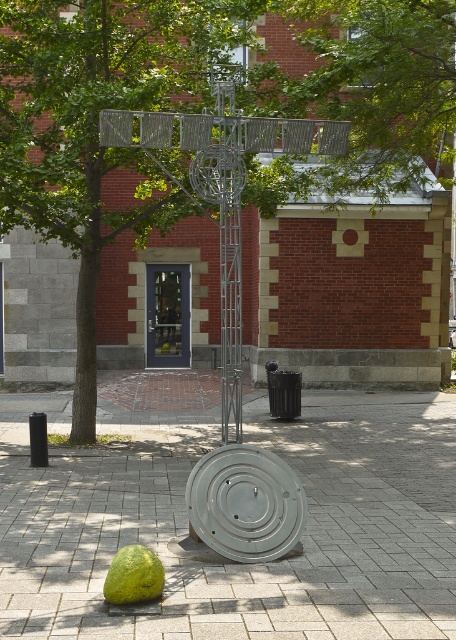
In the scene shown: Between white concrete pavement at center and green leafy tree at center, which one has less height?

green leafy tree at center

Locate an element on the screen. This screenshot has width=456, height=640. white concrete pavement at center is located at coordinates (236, 563).

Is green leafy tree at center below green leafy tree at upper center?

Correct, green leafy tree at center is located below green leafy tree at upper center.

Does green leafy tree at center have a larger size compared to green leafy tree at upper center?

Incorrect, green leafy tree at center is not larger than green leafy tree at upper center.

Who is more forward, (264, 184) or (447, 28)?

Point (447, 28)

At what (x,y) coordinates should I click in order to perform the action: click on green leafy tree at center. Please return your answer as a coordinate pair (x, y). Looking at the image, I should click on (197, 109).

Can you confirm if white concrete pavement at center is bigger than green leafy tree at upper center?

Correct, white concrete pavement at center is larger in size than green leafy tree at upper center.

What do you see at coordinates (236, 563) in the screenshot?
I see `white concrete pavement at center` at bounding box center [236, 563].

Identify the location of white concrete pavement at center. This screenshot has width=456, height=640. pos(236,563).